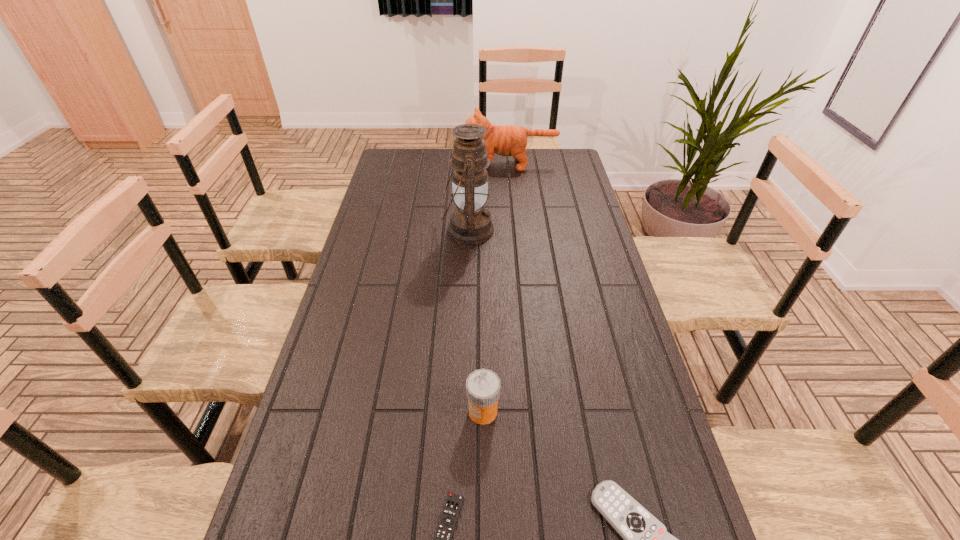
Where is `the second farthest object`? This screenshot has width=960, height=540. the second farthest object is located at coordinates (470, 223).

What are the coordinates of `oil lamp` in the screenshot? It's located at (470, 223).

You are a GUI agent. You are given a task and a screenshot of the screen. Output one action in this format:
    pyautogui.click(x=<x>, y=<y>)
    Task: Click on the second tallest object
    
    Given the screenshot: What is the action you would take?
    pos(507,140)

At what (x,y) coordinates should I click in order to perform the action: click on cat. Please return your answer as a coordinate pair (x, y). The height and width of the screenshot is (540, 960). Looking at the image, I should click on (507, 140).

Where is `medicine`? medicine is located at coordinates 483,386.

Where is `the third tallest object`? The image size is (960, 540). the third tallest object is located at coordinates (483, 386).

At what (x,y) coordinates should I click in order to perform the action: click on free space located on the front of the oil lamp. Please return your answer as a coordinate pair (x, y). Looking at the image, I should click on pyautogui.click(x=465, y=336).

This screenshot has height=540, width=960. I want to click on free location located on the face of the cat, so click(382, 164).

Locate an element on the screen. This screenshot has width=960, height=540. vacant area located on the face of the cat is located at coordinates (441, 164).

You are a GUI agent. You are given a task and a screenshot of the screen. Output one action in this format:
    pyautogui.click(x=<x>, y=<y>)
    Task: Click on the blank space located on the face of the cat
    The width and height of the screenshot is (960, 540).
    Given the screenshot: What is the action you would take?
    pyautogui.click(x=443, y=164)